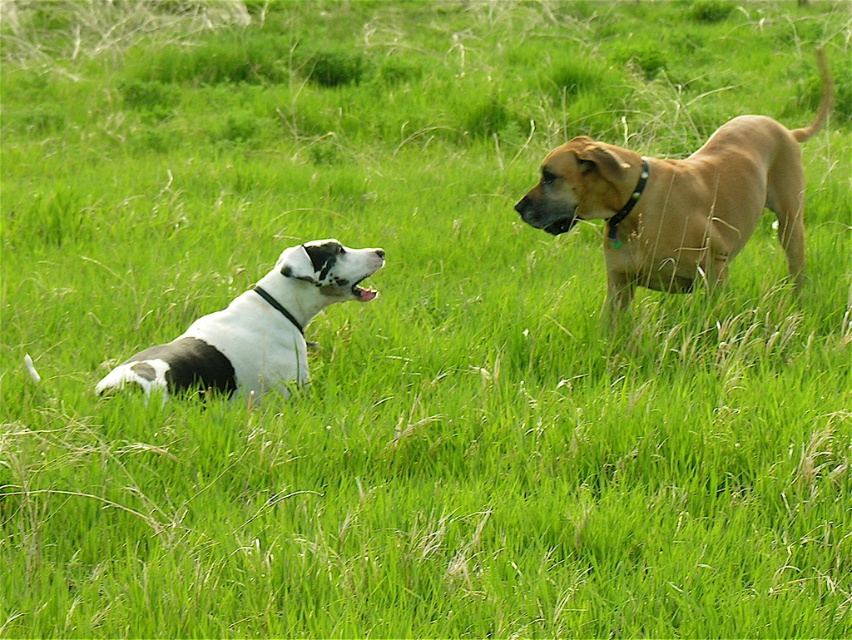
Question: Which object is closer to the camera taking this photo?

Choices:
 (A) black leather neckband at upper right
 (B) white-black fur dog at left

Answer: (B)

Question: Among these points, which one is farthest from the camera?

Choices:
 (A) (223, 384)
 (B) (741, 240)

Answer: (B)

Question: Is white-black fur dog at left bigger than black leather neckband at upper right?

Choices:
 (A) yes
 (B) no

Answer: (A)

Question: Can you confirm if white-black fur dog at left is wider than black leather neckband at upper right?

Choices:
 (A) no
 (B) yes

Answer: (B)

Question: Which object is positioned closest to the golden tan fur at right?

Choices:
 (A) black leather neckband at upper right
 (B) white-black fur dog at left

Answer: (A)

Question: Is golden tan fur at right smaller than white-black fur dog at left?

Choices:
 (A) no
 (B) yes

Answer: (A)